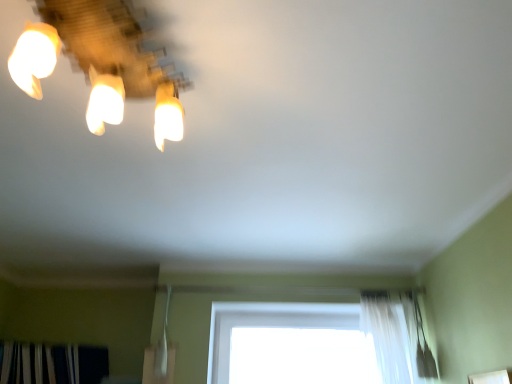
Find the location of a particular element. This screenshot has height=384, width=512. dark green textured curtain at lower left is located at coordinates (52, 364).

From the picture: What is the approximate width of matte glass lamp at upper left?

13.13 inches.

Where is `dark green textured curtain at lower left`? dark green textured curtain at lower left is located at coordinates (52, 364).

Would you say white sheer curtain at lower right is outside matte glass lamp at upper left?

That's correct, white sheer curtain at lower right is outside of matte glass lamp at upper left.

Would you say white sheer curtain at lower right is a long distance from matte glass lamp at upper left?

Indeed, white sheer curtain at lower right is not near matte glass lamp at upper left.

Visually, is white sheer curtain at lower right positioned to the left or to the right of matte glass lamp at upper left?

From the image, it's evident that white sheer curtain at lower right is to the right of matte glass lamp at upper left.

Based on their positions, is dark green textured curtain at lower left located to the left or right of matte glass lamp at upper left?

Clearly, dark green textured curtain at lower left is on the left of matte glass lamp at upper left in the image.

Is dark green textured curtain at lower left outside of matte glass lamp at upper left?

dark green textured curtain at lower left lies outside matte glass lamp at upper left's area.

In the scene shown: Could you tell me if dark green textured curtain at lower left is turned towards matte glass lamp at upper left?

Yes, dark green textured curtain at lower left is turned towards matte glass lamp at upper left.

Locate an element on the screen. The width and height of the screenshot is (512, 384). shower curtain below the matte glass lamp at upper left (from a real-world perspective) is located at coordinates (385, 338).

What's the angular difference between matte glass lamp at upper left and white sheer curtain at lower right's facing directions?

The angular difference between matte glass lamp at upper left and white sheer curtain at lower right is 92.3 degrees.

Who is shorter, matte glass lamp at upper left or white sheer curtain at lower right?

matte glass lamp at upper left.

Is the position of matte glass lamp at upper left less distant than that of white sheer curtain at lower right?

Yes, the depth of matte glass lamp at upper left is less than that of white sheer curtain at lower right.

Is white sheer curtain at lower right located outside dark green textured curtain at lower left?

Yes, white sheer curtain at lower right is outside of dark green textured curtain at lower left.

Who is bigger, white sheer curtain at lower right or dark green textured curtain at lower left?

dark green textured curtain at lower left.

Which object is positioned more to the left, white sheer curtain at lower right or dark green textured curtain at lower left?

dark green textured curtain at lower left.

Can you confirm if white sheer curtain at lower right is wider than dark green textured curtain at lower left?

In fact, white sheer curtain at lower right might be narrower than dark green textured curtain at lower left.

Which object is further away from the camera taking this photo, matte glass lamp at upper left or dark green textured curtain at lower left?

dark green textured curtain at lower left is further away from the camera.

Is dark green textured curtain at lower left surrounded by matte glass lamp at upper left?

No, dark green textured curtain at lower left is located outside of matte glass lamp at upper left.

From the image's perspective, which one is positioned higher, matte glass lamp at upper left or dark green textured curtain at lower left?

From the image's view, matte glass lamp at upper left is above.

Is matte glass lamp at upper left oriented away from dark green textured curtain at lower left?

No, matte glass lamp at upper left's orientation is not away from dark green textured curtain at lower left.

Looking at this image, is dark green textured curtain at lower left facing away from white sheer curtain at lower right?

No, white sheer curtain at lower right is not at the back of dark green textured curtain at lower left.

Can you confirm if dark green textured curtain at lower left is smaller than white sheer curtain at lower right?

No, dark green textured curtain at lower left is not smaller than white sheer curtain at lower right.

This screenshot has width=512, height=384. Identify the location of lamp above the white sheer curtain at lower right (from a real-world perspective). (102, 60).

Image resolution: width=512 pixels, height=384 pixels. Identify the location of lamp on the right side of dark green textured curtain at lower left. (102, 60).

Which object lies nearer to the anchor point matte glass lamp at upper left, white sheer curtain at lower right or dark green textured curtain at lower left?

white sheer curtain at lower right is closer to matte glass lamp at upper left.

Looking at the image, which one is located closer to white sheer curtain at lower right, matte glass lamp at upper left or dark green textured curtain at lower left?

dark green textured curtain at lower left is positioned closer to the anchor white sheer curtain at lower right.

Considering their positions, is matte glass lamp at upper left positioned further to dark green textured curtain at lower left than white sheer curtain at lower right?

matte glass lamp at upper left.

Which object lies further to the anchor point dark green textured curtain at lower left, white sheer curtain at lower right or matte glass lamp at upper left?

The object further to dark green textured curtain at lower left is matte glass lamp at upper left.

Which object lies further to the anchor point matte glass lamp at upper left, dark green textured curtain at lower left or white sheer curtain at lower right?

dark green textured curtain at lower left lies further to matte glass lamp at upper left than the other object.

Considering their positions, is dark green textured curtain at lower left positioned closer to white sheer curtain at lower right than matte glass lamp at upper left?

dark green textured curtain at lower left is closer to white sheer curtain at lower right.

Find the location of `lamp between dark green textured curtain at lower left and white sheer curtain at lower right in the horizontal direction`. lamp between dark green textured curtain at lower left and white sheer curtain at lower right in the horizontal direction is located at coordinates 102,60.